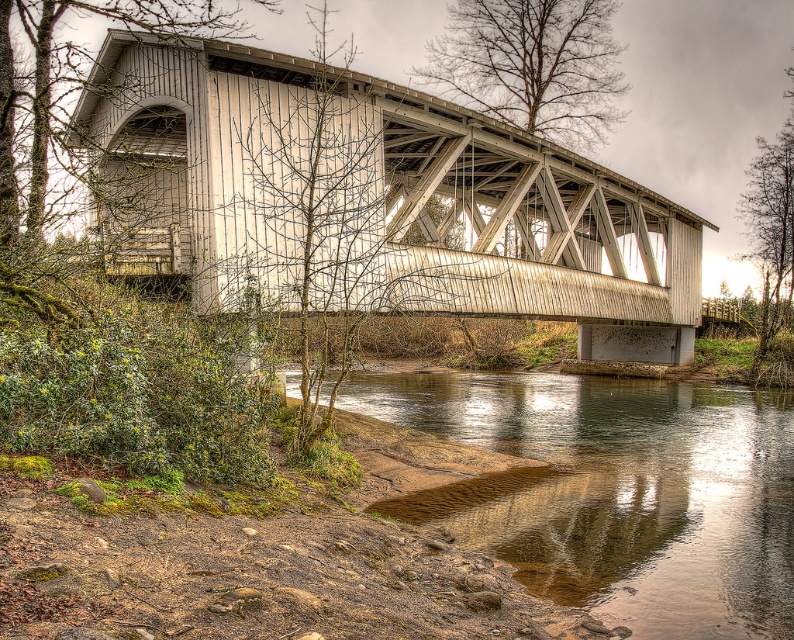
You are standing on the riverbank and see the point marked at coordinates point (x=384, y=196). Which structure is this point located on?

The point (x=384, y=196) is located on the white wooden bridge at center.

You are standing on the riverbank and want to cross the river using the white wooden bridge at center and the brown sedimentary river at lower center. Which one is taller and can you use it to cross?

The white wooden bridge at center has a greater height compared to the brown sedimentary river at lower center, so you can use the white wooden bridge at center to cross since it is taller and provides a stable path over the river.

You are standing at the entrance of a park and see the white wooden bridge at center. If you want to take a photo of it from a closer position, how much closer should you move towards it?

You need to move 64.26 feet closer to the white wooden bridge at center to take the photo from a closer position.